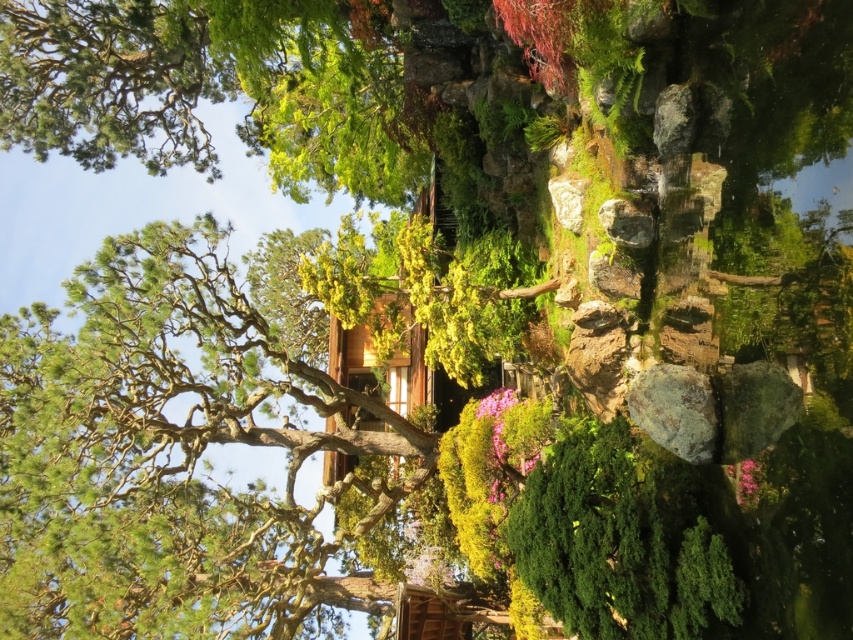
You are standing in a Japanese garden and want to reach a specific point marked as point [694,385]. If you can walk 8 meters in one minute, how long will it take you to reach that point?

The distance between you and point [694,385] is 7.84 meters. Since you can walk 8 meters in a minute, it will take approximately one minute to reach the point.

You are a gardener who wants to plant a new tree in the Japanese garden. You have the green textured tree at center and the pink matte flower at center in your current view. Which one is smaller in size?

The green textured tree at center has a smaller size compared to the pink matte flower at center.